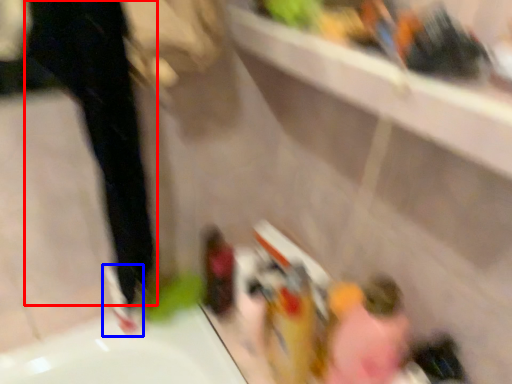
Question: Which object is further to the camera taking this photo, pants (highlighted by a red box) or shoe (highlighted by a blue box)?

Choices:
 (A) pants
 (B) shoe

Answer: (B)